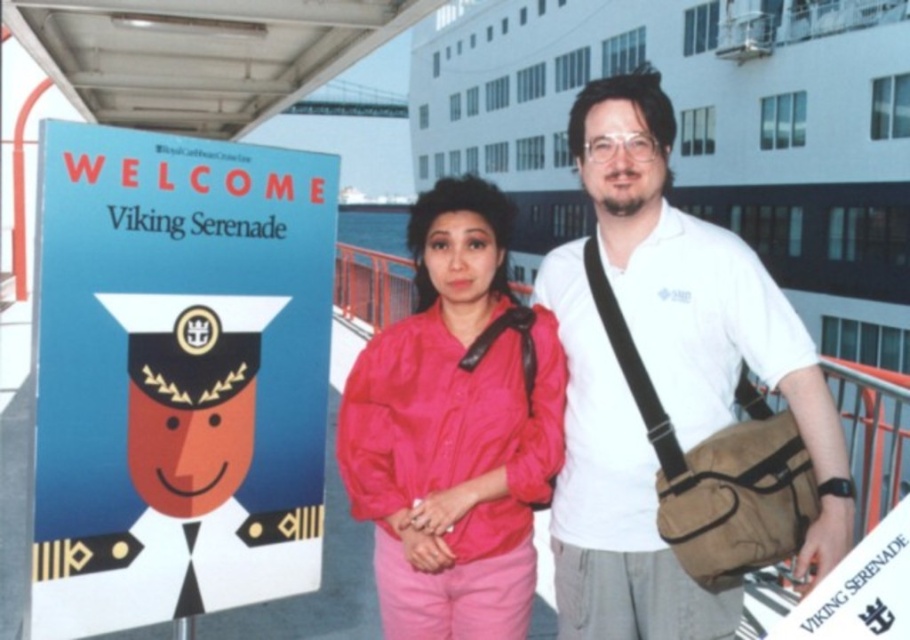
Based on the photo, you are a photographer taking a picture of the cruise ship and its crew members. You notice the white cotton shirt at center and the matte pink jacket at center. Which clothing item is positioned higher on the crew member?

The white cotton shirt at center is located above the matte pink jacket at center, so it is positioned higher on the crew member.